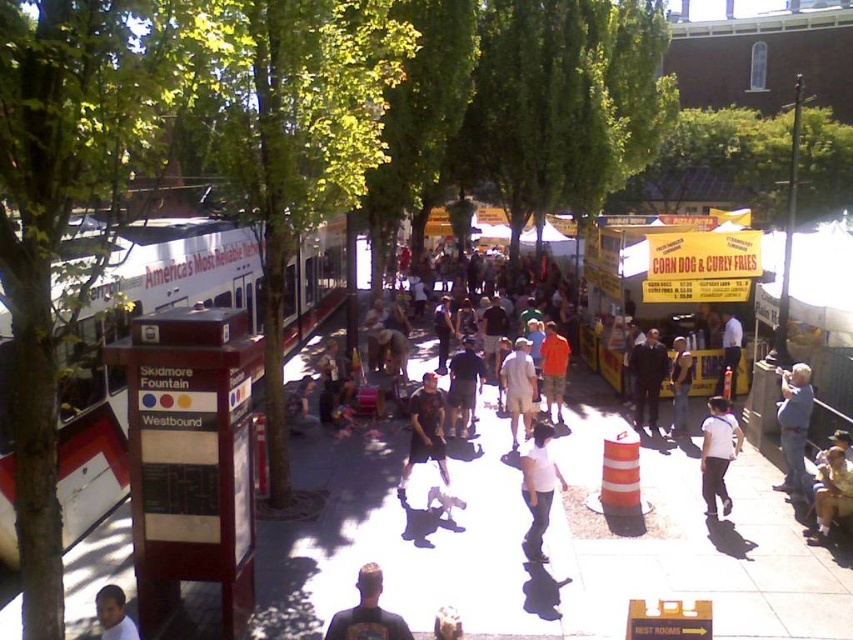
Question: Which point is farther to the camera?

Choices:
 (A) (672, 385)
 (B) (113, 616)
 (C) (524, 378)

Answer: (A)

Question: Which object is farther from the camera taking this photo?

Choices:
 (A) light beige shorts at center
 (B) yellow/yellowish cardboard food truck at center-right
 (C) dark gray t-shirt at center

Answer: (B)

Question: Does white matte shirt at center have a greater width compared to orange cotton shirt at center?

Choices:
 (A) yes
 (B) no

Answer: (A)

Question: Is white matte shirt at center-right below orange cotton shirt at center?

Choices:
 (A) no
 (B) yes

Answer: (B)

Question: Does dark gray t-shirt at center have a lesser width compared to orange cotton shirt at center?

Choices:
 (A) yes
 (B) no

Answer: (B)

Question: Which object is closer to the camera taking this photo?

Choices:
 (A) light blue shirt at center
 (B) dark gray t-shirt at center
 (C) white matte shirt at center
 (D) white matte shirt at center-right

Answer: (C)